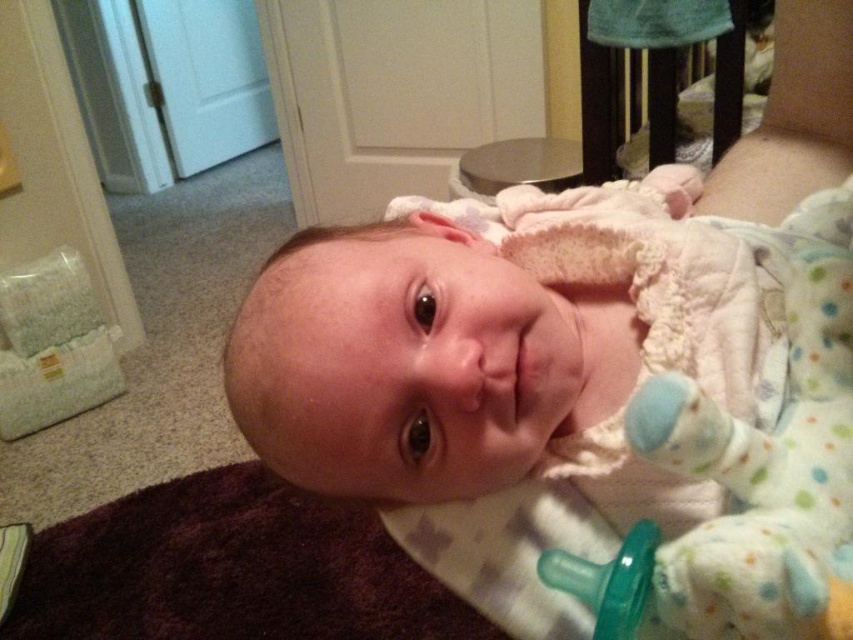
You are a photographer setting up a studio for a baby photoshoot. The studio has limited space, and you need to position the white soft fabric baby at center and the wooden crib at upper right. Given their sizes, which object should you place closer to the camera to ensure both are visible in the frame?

The white soft fabric baby at center is smaller than the wooden crib at upper right. To ensure both are visible in the frame, place the white soft fabric baby at center closer to the camera so it appears larger in the photo, while keeping the wooden crib at upper right further back.

You are a parent trying to put your baby into the wooden crib at upper right. The baby is currently lying on the carpet. Can you directly reach the crib from the baby without moving the baby?

The wooden crib at upper right is located at point (659, 77), so yes, you can directly reach the crib from the baby without moving the baby since the crib is already positioned near the baby on the carpet.